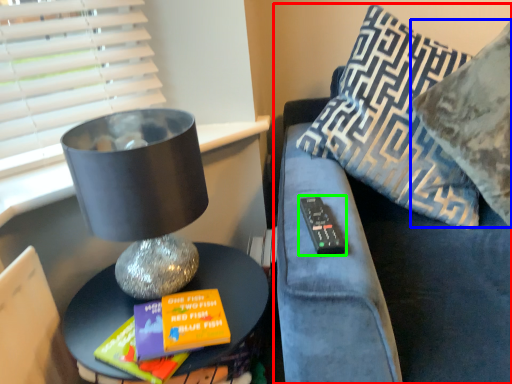
Question: Which is nearer to the furniture (highlighted by a red box)? pillow (highlighted by a blue box) or remote (highlighted by a green box).

Choices:
 (A) pillow
 (B) remote

Answer: (B)